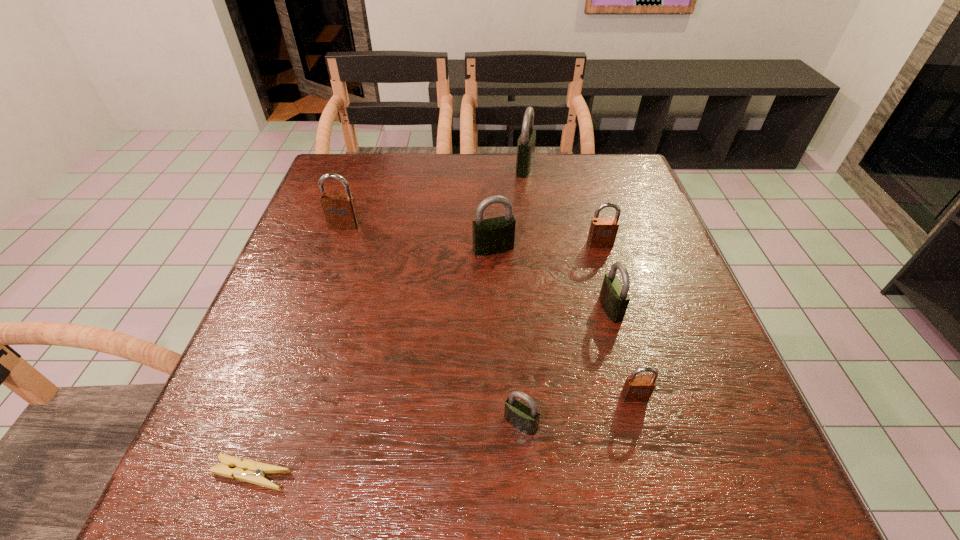
I want to click on vacant area located on the front-facing side of the third nearest object, so click(x=643, y=429).

Find the location of `free spot located on the right of the shortest object`. free spot located on the right of the shortest object is located at coordinates (454, 474).

You are a GUI agent. You are given a task and a screenshot of the screen. Output one action in this format:
    pyautogui.click(x=<x>, y=<y>)
    Task: Click on the object at the far edge
    The height and width of the screenshot is (540, 960).
    Given the screenshot: What is the action you would take?
    pyautogui.click(x=526, y=143)

You are a GUI agent. You are given a task and a screenshot of the screen. Output one action in this format:
    pyautogui.click(x=<x>, y=<y>)
    Task: Click on the object present at the near edge
    The height and width of the screenshot is (540, 960).
    Given the screenshot: What is the action you would take?
    pyautogui.click(x=249, y=471)

Find the location of a particular element. This screenshot has width=960, height=540. padlock situated at the left edge is located at coordinates (340, 211).

Locate an element on the screen. This screenshot has height=540, width=960. clothespin present at the left edge is located at coordinates (249, 471).

Where is `object located in the near left corner section of the desktop`? This screenshot has width=960, height=540. object located in the near left corner section of the desktop is located at coordinates (249, 471).

You are a GUI agent. You are given a task and a screenshot of the screen. Output one action in this format:
    pyautogui.click(x=<x>, y=<y>)
    Task: Click on the free region at the far edge of the desktop
    The width and height of the screenshot is (960, 540).
    Given the screenshot: What is the action you would take?
    pyautogui.click(x=516, y=190)

At what (x,y) coordinates should I click in order to perform the action: click on free space at the near edge of the desktop. Please return your answer as a coordinate pair (x, y). The width and height of the screenshot is (960, 540). Looking at the image, I should click on (515, 459).

Find the location of a particular element. The width and height of the screenshot is (960, 540). vacant point at the left edge is located at coordinates (305, 234).